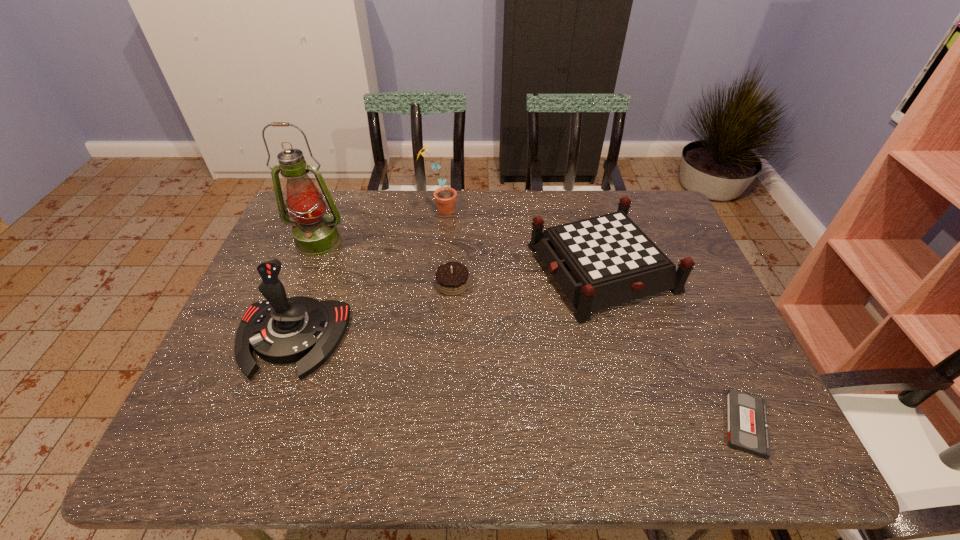
Locate an element on the screen. free area in between the sunflower and the joystick is located at coordinates (366, 274).

Identify the location of vacant area that lies between the fifth tallest object and the third shortest object. (527, 276).

Where is `free space between the sunflower and the oil lamp`? This screenshot has width=960, height=540. free space between the sunflower and the oil lamp is located at coordinates (379, 226).

Identify the location of unoccupied area between the chocolate cake and the joystick. (372, 311).

Identify the location of vacant space that's between the sunflower and the nearest object. (593, 317).

Locate an element on the screen. empty space between the sunflower and the fourth tallest object is located at coordinates (521, 239).

The width and height of the screenshot is (960, 540). In order to click on free point between the sunflower and the oil lamp in this screenshot , I will do `click(379, 226)`.

This screenshot has height=540, width=960. Find the location of `vacant space in between the fourth tallest object and the joystick`. vacant space in between the fourth tallest object and the joystick is located at coordinates (446, 303).

Find the location of a particular element. The image size is (960, 540). empty space between the sunflower and the checkerboard is located at coordinates (521, 239).

What are the coordinates of `blank region between the fourth tallest object and the sunflower` in the screenshot? It's located at (521, 239).